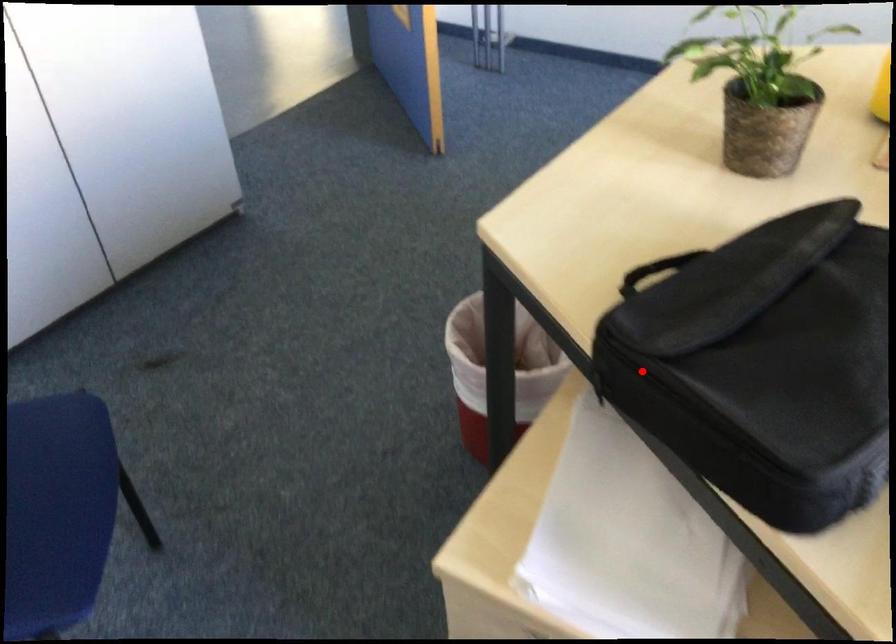
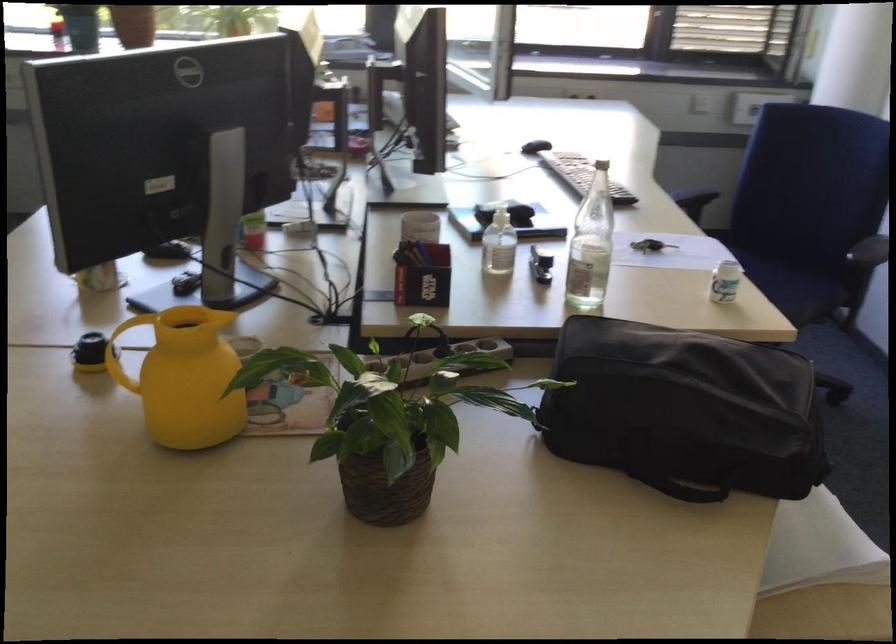
Question: I am providing you with two images of the same scene from different viewpoints. A red point is marked on the first image. Can you still see the location of the red point in image 2?

Choices:
 (A) Yes
 (B) No

Answer: (A)